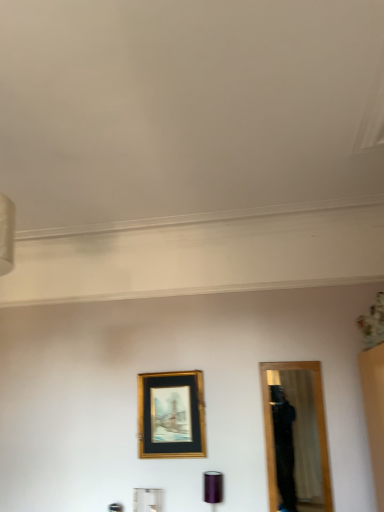
Question: From the image's perspective, is gold metallic picture frame at center above or below purple metallic cylinder at lower center?

Choices:
 (A) below
 (B) above

Answer: (B)

Question: In terms of width, does gold metallic picture frame at center look wider or thinner when compared to purple metallic cylinder at lower center?

Choices:
 (A) thin
 (B) wide

Answer: (A)

Question: Is point (183, 412) closer or farther from the camera than point (211, 478)?

Choices:
 (A) closer
 (B) farther

Answer: (B)

Question: Looking at the image, does purple metallic cylinder at lower center seem bigger or smaller compared to gold metallic picture frame at center?

Choices:
 (A) small
 (B) big

Answer: (A)

Question: Considering their positions, is purple metallic cylinder at lower center located in front of or behind gold metallic picture frame at center?

Choices:
 (A) front
 (B) behind

Answer: (A)

Question: Is purple metallic cylinder at lower center wider or thinner than gold metallic picture frame at center?

Choices:
 (A) wide
 (B) thin

Answer: (A)

Question: From a real-world perspective, is purple metallic cylinder at lower center above or below gold metallic picture frame at center?

Choices:
 (A) above
 (B) below

Answer: (B)